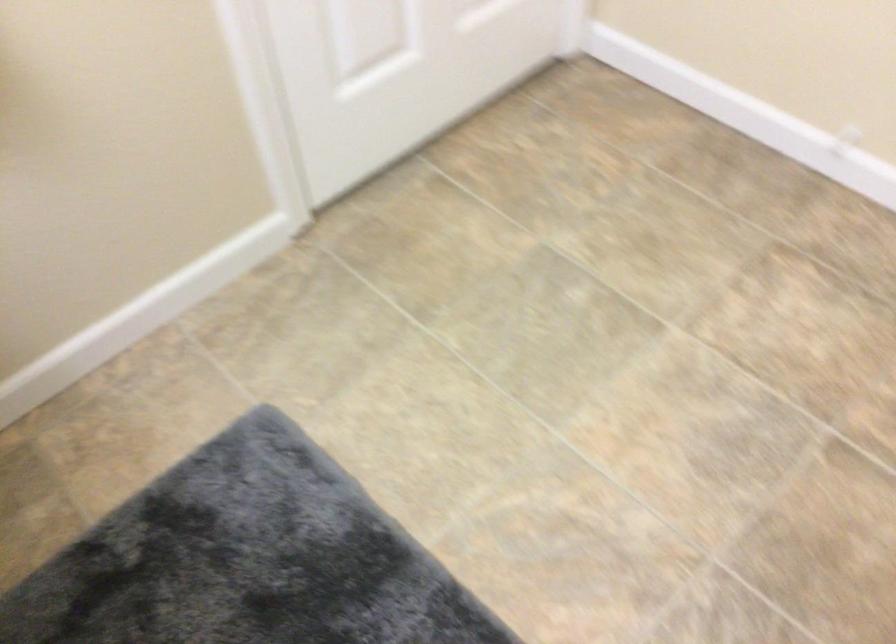
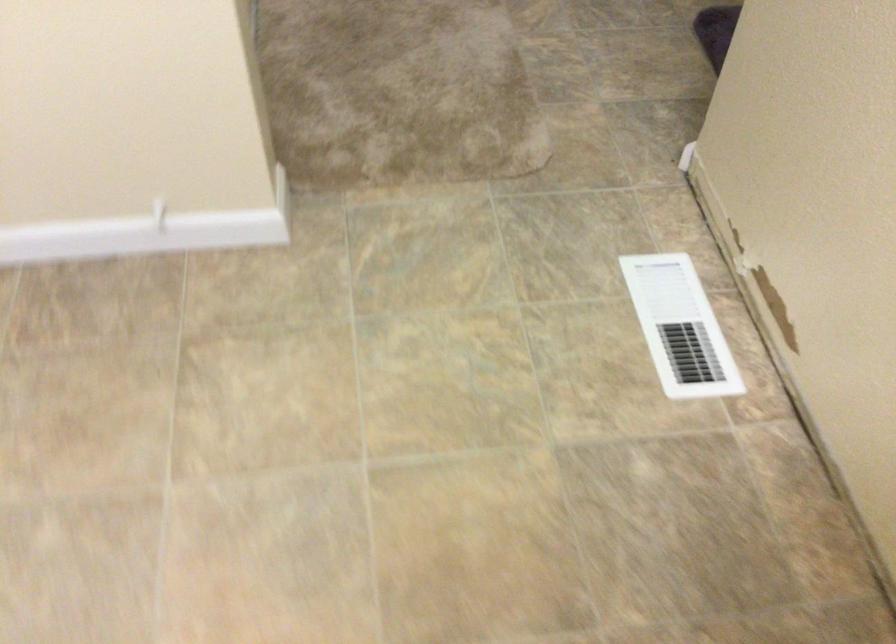
Question: The camera is either moving clockwise (left) or counter-clockwise (right) around the object. The first image is from the beginning of the video and the second image is from the end. Is the camera moving left or right when shooting the video?

Choices:
 (A) Left
 (B) Right

Answer: (A)